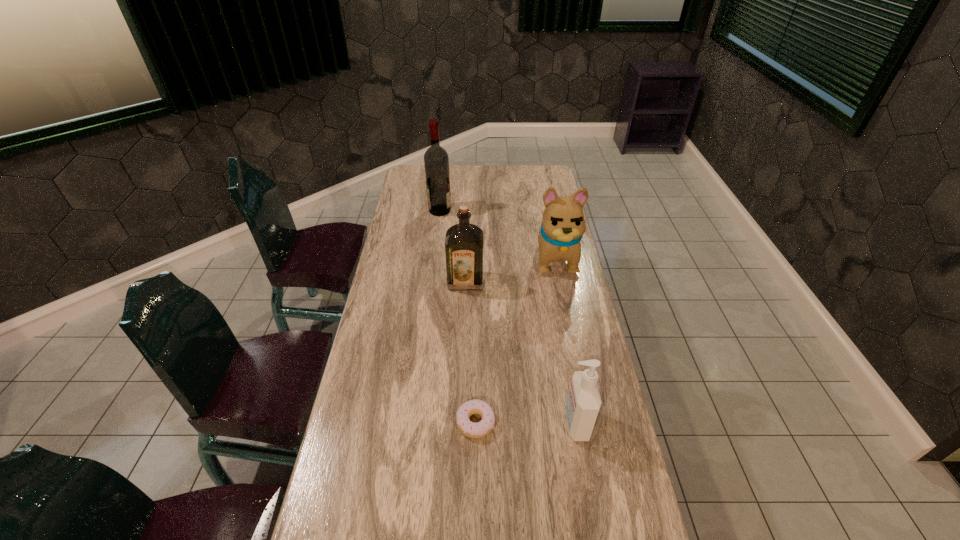
Find the location of a particular element. empty location between the shortest object and the cleansing agent is located at coordinates (526, 423).

Locate an element on the screen. This screenshot has width=960, height=540. free area in between the doughnut and the liquor is located at coordinates (470, 352).

Image resolution: width=960 pixels, height=540 pixels. Identify the location of free point between the alcohol and the cleansing agent. (508, 317).

Where is `free space between the fourth tallest object and the alcohol`? The height and width of the screenshot is (540, 960). free space between the fourth tallest object and the alcohol is located at coordinates (508, 317).

The image size is (960, 540). In order to click on free point between the leftmost object and the puppy in this screenshot , I will do `click(497, 234)`.

This screenshot has width=960, height=540. What are the coordinates of `free space between the puppy and the liquor` in the screenshot? It's located at (511, 269).

Image resolution: width=960 pixels, height=540 pixels. Identify the location of vacant point located between the shortest object and the farthest object. (458, 316).

This screenshot has width=960, height=540. What are the coordinates of `free point between the liquor and the puppy` in the screenshot? It's located at (511, 269).

Select which object is the closest to the cleansing agent. Please provide its 2D coordinates. Your answer should be formatted as a tuple, i.e. [(x, y)], where the tuple contains the x and y coordinates of a point satisfying the conditions above.

[(470, 429)]

Where is `object that is the second closest one to the puppy`? The width and height of the screenshot is (960, 540). object that is the second closest one to the puppy is located at coordinates 436,161.